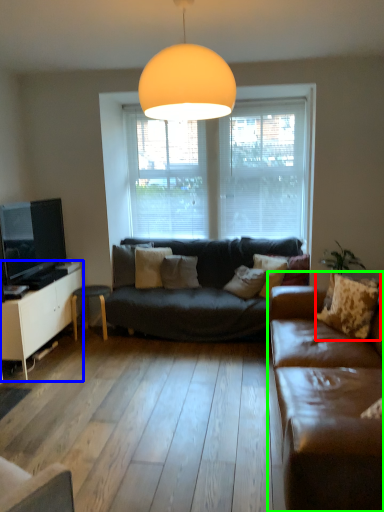
Question: Which object is the farthest from pillow (highlighted by a red box)? Choose among these: cabinetry (highlighted by a blue box) or studio couch (highlighted by a green box).

Choices:
 (A) cabinetry
 (B) studio couch

Answer: (A)